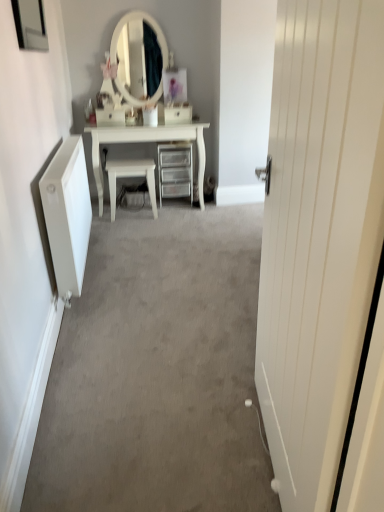
Question: From the image's perspective, is white glossy drawer at center, the first drawer from the left, above or below clear plastic drawers at center?

Choices:
 (A) below
 (B) above

Answer: (B)

Question: From their relative heights in the image, would you say white glossy drawer at center, marked as the second drawer in a right-to-left arrangement, is taller or shorter than clear plastic drawers at center?

Choices:
 (A) tall
 (B) short

Answer: (B)

Question: Estimate the real-world distances between objects in this image. Which object is farther from the clear plastic drawers at center?

Choices:
 (A) white plastic drawer at center, which appears as the 1th drawer when viewed from the right
 (B) white glossy chair at center
 (C) metallic mirror at upper left
 (D) white glossy drawer at center, marked as the second drawer in a right-to-left arrangement
 (E) white wooden door at right

Answer: (E)

Question: Which is farther from the white glossy drawer at center, marked as the second drawer in a right-to-left arrangement?

Choices:
 (A) white plastic drawer at center, acting as the second drawer starting from the left
 (B) white wooden door at right
 (C) white glossy chair at center
 (D) clear plastic drawers at center
 (E) metallic mirror at upper left

Answer: (B)